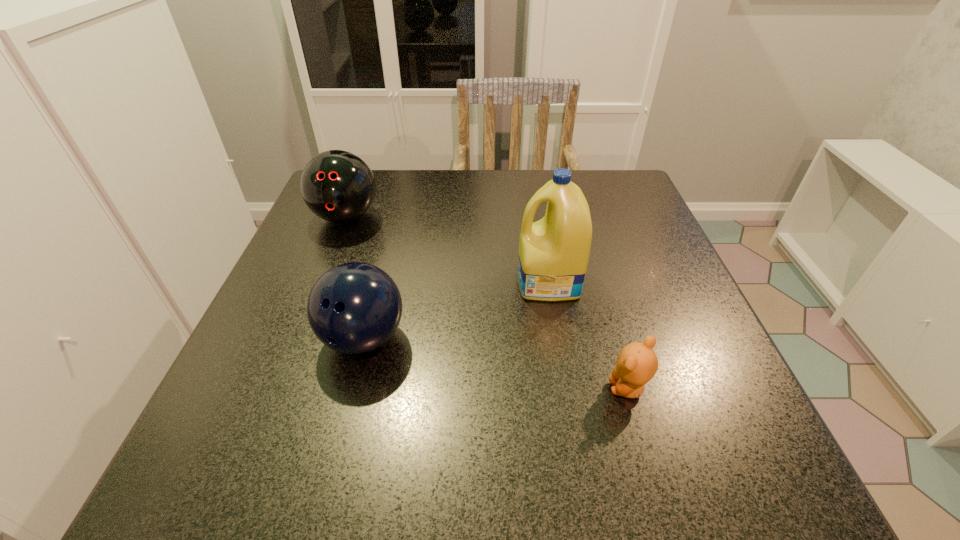
Locate an element on the screen. The width and height of the screenshot is (960, 540). free space at the right edge is located at coordinates (604, 234).

In the image, there is a desktop. At what (x,y) coordinates should I click in order to perform the action: click on free region at the far left corner. Please return your answer as a coordinate pair (x, y). Looking at the image, I should click on (315, 219).

I want to click on free space at the far right corner of the desktop, so click(x=639, y=191).

Find the location of a particular element. Image resolution: width=960 pixels, height=540 pixels. vacant space that's between the farthest object and the teddy bear is located at coordinates (487, 303).

You are a GUI agent. You are given a task and a screenshot of the screen. Output one action in this format:
    pyautogui.click(x=<x>, y=<y>)
    Task: Click on the free space that is in between the teddy bear and the detergent
    The height and width of the screenshot is (540, 960).
    Given the screenshot: What is the action you would take?
    pyautogui.click(x=588, y=335)

The width and height of the screenshot is (960, 540). What are the coordinates of `free space between the detergent and the farthest object` in the screenshot? It's located at (447, 249).

Locate an element on the screen. free space that is in between the nearer bowling ball and the detergent is located at coordinates (456, 310).

Identify the location of blank region between the farther bowling ball and the detergent. (447, 249).

Image resolution: width=960 pixels, height=540 pixels. I want to click on empty location between the detergent and the nearer bowling ball, so click(456, 310).

Identify the location of unoccupied area between the farthest object and the detergent. (447, 249).